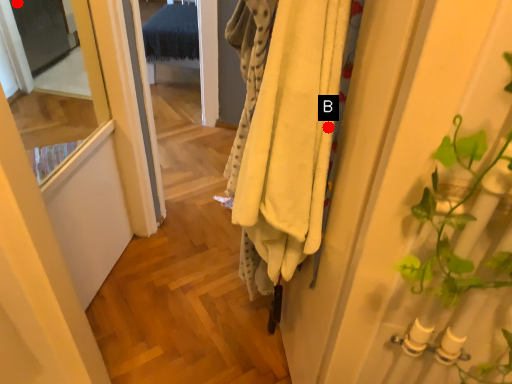
Question: Two points are circled on the image, labeled by A and B beside each circle. Which point appears farthest from the camera in this image?

Choices:
 (A) A is further
 (B) B is further

Answer: (A)